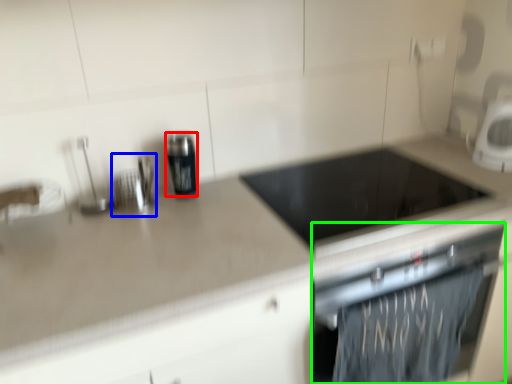
Question: Which object is the farthest from kitchen appliance (highlighted by a red box)? Choose among these: appliance (highlighted by a blue box) or home appliance (highlighted by a green box).

Choices:
 (A) appliance
 (B) home appliance

Answer: (B)